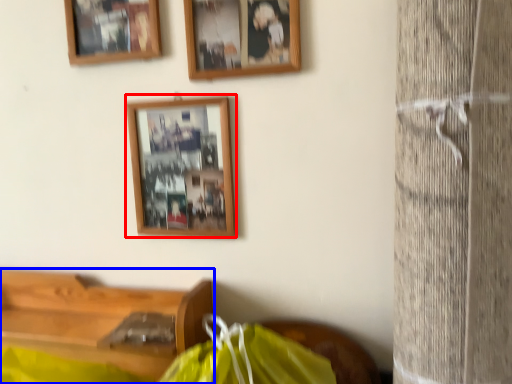
Question: Which object is closer to the camera taking this photo, picture frame (highlighted by a red box) or furniture (highlighted by a blue box)?

Choices:
 (A) picture frame
 (B) furniture

Answer: (B)